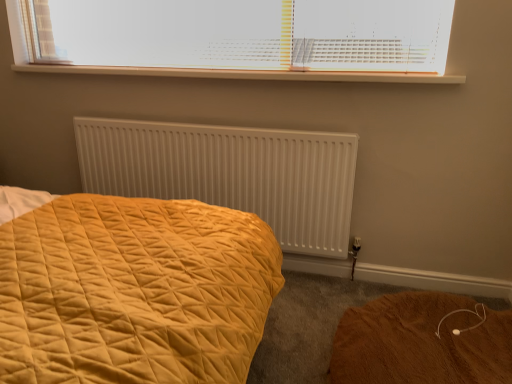
Question: Is white plastic blinds at upper center oriented towards brown fuzzy rug at lower right?

Choices:
 (A) no
 (B) yes

Answer: (A)

Question: From the image's perspective, is white plastic blinds at upper center over brown fuzzy rug at lower right?

Choices:
 (A) yes
 (B) no

Answer: (A)

Question: From the image's perspective, is white plastic blinds at upper center located beneath brown fuzzy rug at lower right?

Choices:
 (A) yes
 (B) no

Answer: (B)

Question: Is brown fuzzy rug at lower right surrounded by white plastic blinds at upper center?

Choices:
 (A) yes
 (B) no

Answer: (B)

Question: Considering the relative sizes of white plastic blinds at upper center and brown fuzzy rug at lower right in the image provided, is white plastic blinds at upper center taller than brown fuzzy rug at lower right?

Choices:
 (A) yes
 (B) no

Answer: (A)

Question: Is white plastic radiator at upper center wider or thinner than white plastic blinds at upper center?

Choices:
 (A) thin
 (B) wide

Answer: (B)

Question: Is white plastic radiator at upper center in front of or behind white plastic blinds at upper center in the image?

Choices:
 (A) front
 (B) behind

Answer: (B)

Question: Does point (375, 72) appear closer or farther from the camera than point (138, 66)?

Choices:
 (A) closer
 (B) farther

Answer: (A)

Question: Would you say white plastic radiator at upper center is to the left or to the right of white plastic blinds at upper center in the picture?

Choices:
 (A) right
 (B) left

Answer: (A)

Question: Based on their sizes in the image, would you say brown fuzzy rug at lower right is bigger or smaller than white matte radiator at center?

Choices:
 (A) small
 (B) big

Answer: (B)

Question: Considering the positions of point (454, 317) and point (151, 139), is point (454, 317) closer or farther from the camera than point (151, 139)?

Choices:
 (A) closer
 (B) farther

Answer: (A)

Question: From the image's perspective, relative to white matte radiator at center, is brown fuzzy rug at lower right above or below?

Choices:
 (A) below
 (B) above

Answer: (A)

Question: Looking at their shapes, would you say brown fuzzy rug at lower right is wider or thinner than white matte radiator at center?

Choices:
 (A) thin
 (B) wide

Answer: (B)

Question: Based on their positions, is white plastic blinds at upper center located to the left or right of white matte radiator at center?

Choices:
 (A) left
 (B) right

Answer: (B)

Question: Would you say white plastic blinds at upper center is inside or outside white matte radiator at center?

Choices:
 (A) outside
 (B) inside

Answer: (A)